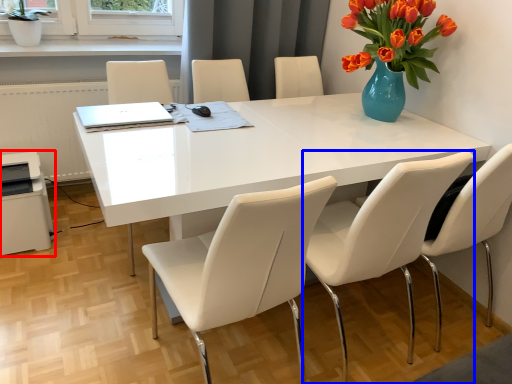
Question: Which point is closer to the camera, printer (highlighted by a red box) or chair (highlighted by a blue box)?

Choices:
 (A) printer
 (B) chair

Answer: (B)